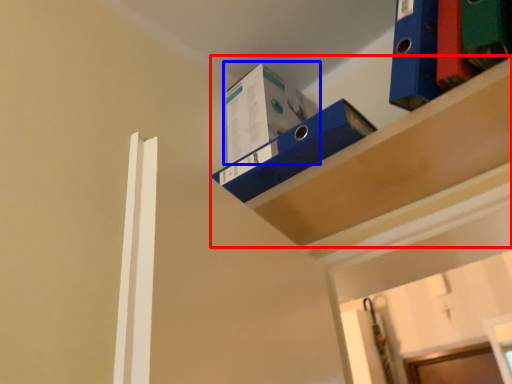
Question: Which point is closer to the camera, shelf (highlighted by a red box) or box (highlighted by a blue box)?

Choices:
 (A) shelf
 (B) box

Answer: (A)